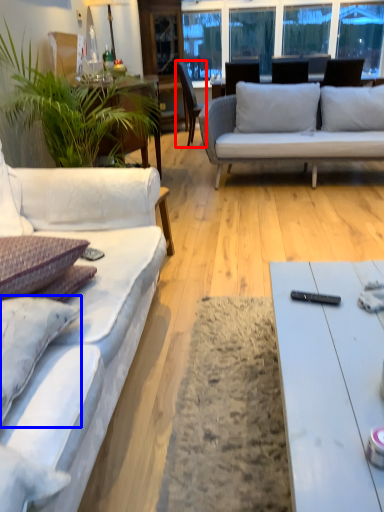
Question: Among these objects, which one is farthest to the camera, chair (highlighted by a red box) or pillow (highlighted by a blue box)?

Choices:
 (A) chair
 (B) pillow

Answer: (A)